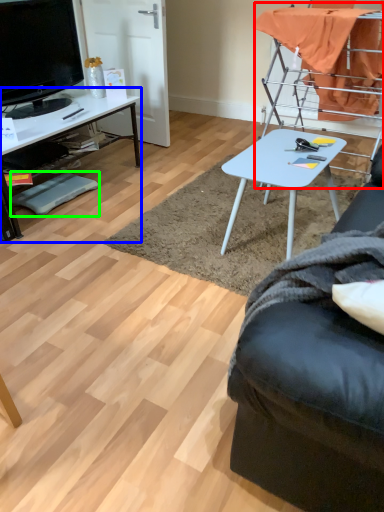
Question: Based on their relative distances, which object is nearer to chair (highlighted by a red box)? Choose from desk (highlighted by a blue box) and footrest (highlighted by a green box).

Choices:
 (A) desk
 (B) footrest

Answer: (A)